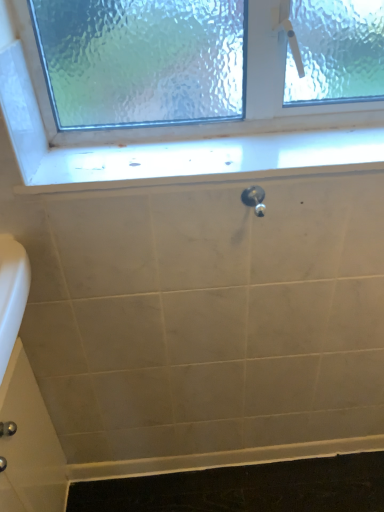
This screenshot has width=384, height=512. What do you see at coordinates (254, 199) in the screenshot?
I see `satin nickel faucet at center` at bounding box center [254, 199].

In order to click on satin nickel faucet at center in this screenshot , I will do `click(254, 199)`.

In the scene shown: Measure the distance between white glossy window sill at upper center and camera.

white glossy window sill at upper center is 31.26 inches from camera.

What do you see at coordinates (210, 159) in the screenshot? The width and height of the screenshot is (384, 512). I see `white glossy window sill at upper center` at bounding box center [210, 159].

Find the location of a particular element. The image size is (384, 512). white glossy window sill at upper center is located at coordinates (210, 159).

What are the coordinates of `satin nickel faucet at center` in the screenshot? It's located at (254, 199).

Considering the positions of objects satin nickel faucet at center and white glossy window sill at upper center in the image provided, who is more to the right, satin nickel faucet at center or white glossy window sill at upper center?

From the viewer's perspective, satin nickel faucet at center appears more on the right side.

In the image, is satin nickel faucet at center positioned in front of or behind white glossy window sill at upper center?

In the image, satin nickel faucet at center appears in front of white glossy window sill at upper center.

Consider the image. Which is closer, (258, 205) or (274, 155)?

Point (258, 205) appears to be closer to the viewer than point (274, 155).

From the image's perspective, between satin nickel faucet at center and white glossy window sill at upper center, who is located below?

satin nickel faucet at center appears lower in the image.

From a real-world perspective, is satin nickel faucet at center physically located above or below white glossy window sill at upper center?

satin nickel faucet at center is situated lower than white glossy window sill at upper center in the real world.

Between satin nickel faucet at center and white glossy window sill at upper center, which one has smaller width?

Thinner between the two is satin nickel faucet at center.

Is satin nickel faucet at center shorter than white glossy window sill at upper center?

No.

Looking at this image, is satin nickel faucet at center bigger than white glossy window sill at upper center?

Incorrect, satin nickel faucet at center is not larger than white glossy window sill at upper center.

Is satin nickel faucet at center spatially inside white glossy window sill at upper center, or outside of it?

satin nickel faucet at center is spatially situated outside white glossy window sill at upper center.

Is there a large distance between satin nickel faucet at center and white glossy window sill at upper center?

satin nickel faucet at center is actually quite close to white glossy window sill at upper center.

Is satin nickel faucet at center positioned with its back to white glossy window sill at upper center?

Yes.

How much distance is there between satin nickel faucet at center and white glossy window sill at upper center?

satin nickel faucet at center is 7.75 inches from white glossy window sill at upper center.

This screenshot has height=512, width=384. Find the location of `plumbing fixture lying below the white glossy window sill at upper center (from the image's perspective)`. plumbing fixture lying below the white glossy window sill at upper center (from the image's perspective) is located at coordinates (254, 199).

Which object is positioned more to the left, white glossy window sill at upper center or satin nickel faucet at center?

white glossy window sill at upper center.

From the picture: Is white glossy window sill at upper center further to the viewer compared to satin nickel faucet at center?

Yes, it is behind satin nickel faucet at center.

Does point (140, 155) appear closer or farther from the camera than point (257, 214)?

Point (140, 155) appears to be farther away from the viewer than point (257, 214).

In the scene shown: From the image's perspective, relative to satin nickel faucet at center, is white glossy window sill at upper center above or below?

Clearly, from the image's perspective, white glossy window sill at upper center is above satin nickel faucet at center.

From a real-world perspective, is white glossy window sill at upper center on satin nickel faucet at center?

Yes, from a real-world perspective, white glossy window sill at upper center is above satin nickel faucet at center.

Does white glossy window sill at upper center have a lesser width compared to satin nickel faucet at center?

No.

Considering the relative sizes of white glossy window sill at upper center and satin nickel faucet at center in the image provided, is white glossy window sill at upper center shorter than satin nickel faucet at center?

Yes, white glossy window sill at upper center is shorter than satin nickel faucet at center.

Does white glossy window sill at upper center have a larger size compared to satin nickel faucet at center?

Indeed, white glossy window sill at upper center has a larger size compared to satin nickel faucet at center.

Do you think white glossy window sill at upper center is within satin nickel faucet at center, or outside of it?

white glossy window sill at upper center is outside satin nickel faucet at center.

Are white glossy window sill at upper center and satin nickel faucet at center making contact?

white glossy window sill at upper center and satin nickel faucet at center are not in contact.

Is white glossy window sill at upper center looking in the opposite direction of satin nickel faucet at center?

No, white glossy window sill at upper center is not facing the opposite direction of satin nickel faucet at center.

How many degrees apart are the facing directions of white glossy window sill at upper center and satin nickel faucet at center?

They differ by 1.27 degrees in their facing directions.

Where is `plumbing fixture below the white glossy window sill at upper center (from a real-world perspective)`? plumbing fixture below the white glossy window sill at upper center (from a real-world perspective) is located at coordinates (254, 199).

This screenshot has height=512, width=384. I want to click on plumbing fixture on the right of white glossy window sill at upper center, so click(x=254, y=199).

You are a GUI agent. You are given a task and a screenshot of the screen. Output one action in this format:
    pyautogui.click(x=<x>, y=<y>)
    Task: Click on the plumbing fixture below the white glossy window sill at upper center (from a real-world perspective)
    The width and height of the screenshot is (384, 512).
    Given the screenshot: What is the action you would take?
    pyautogui.click(x=254, y=199)